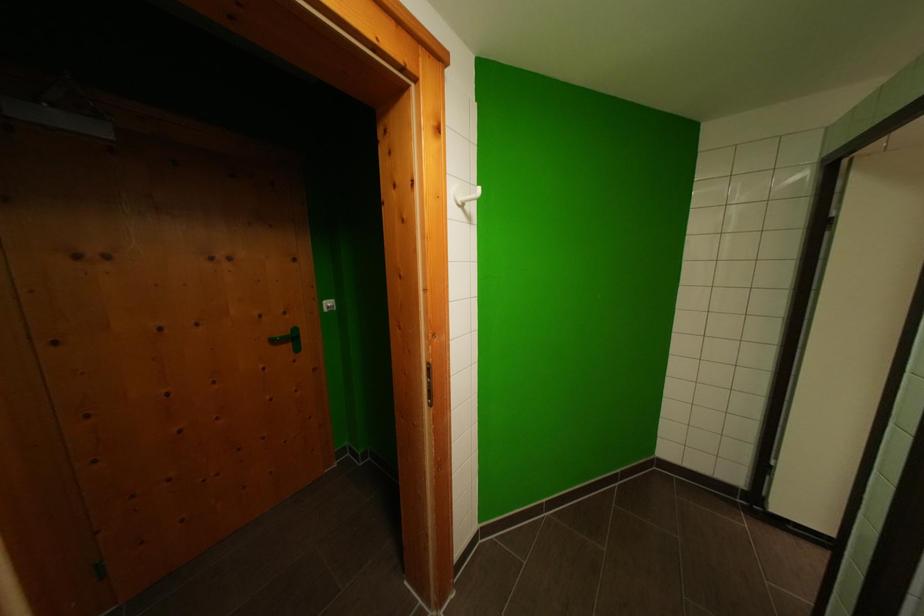
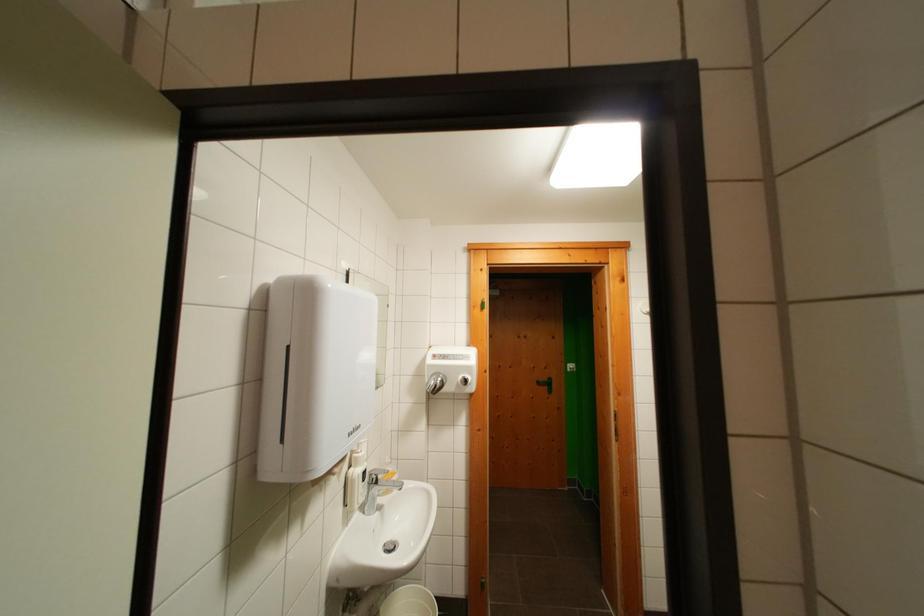
Where in the second image is the point corresponding to [281,345] from the first image?

(544, 387)